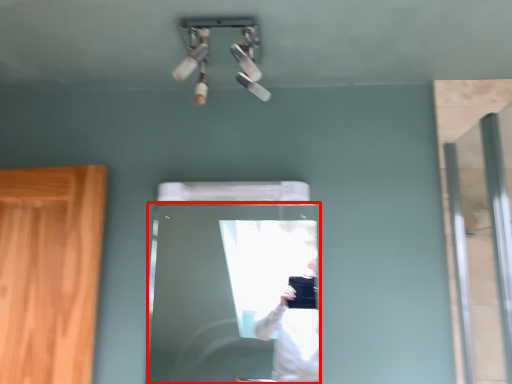
Question: Where is door (annotated by the red box) located in relation to screen door in the image?

Choices:
 (A) left
 (B) right

Answer: (A)